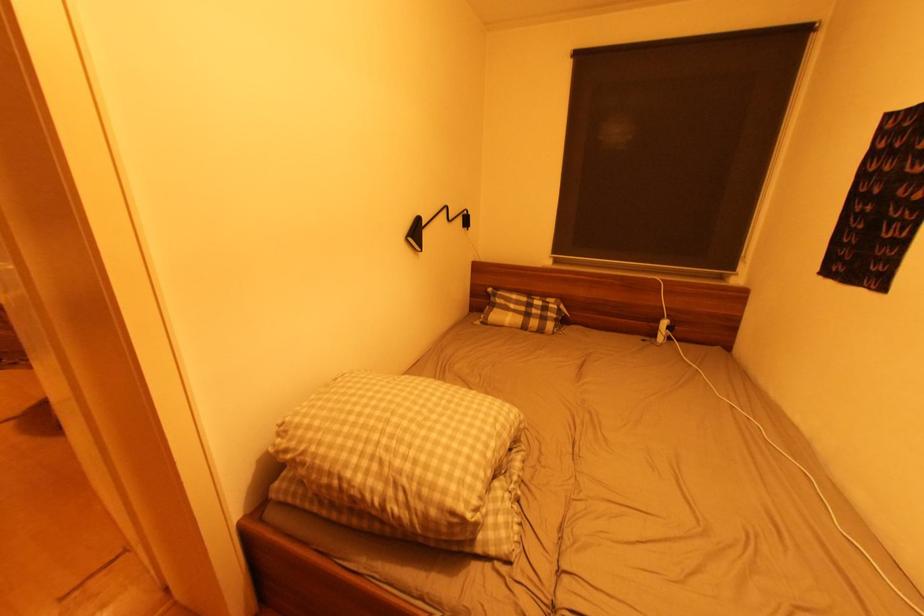
The location [663,331] corresponds to which object?

This point indicates the white power strip.